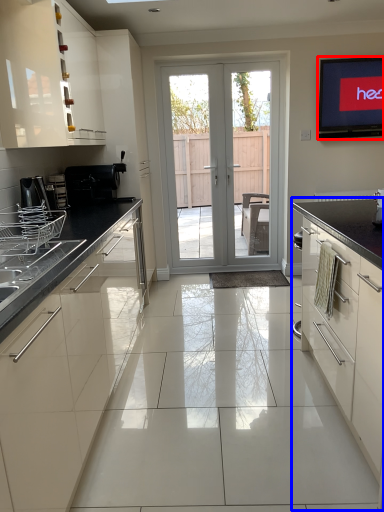
Question: Which object appears farthest to the camera in this image, electronic (highlighted by a red box) or cabinetry (highlighted by a blue box)?

Choices:
 (A) electronic
 (B) cabinetry

Answer: (A)